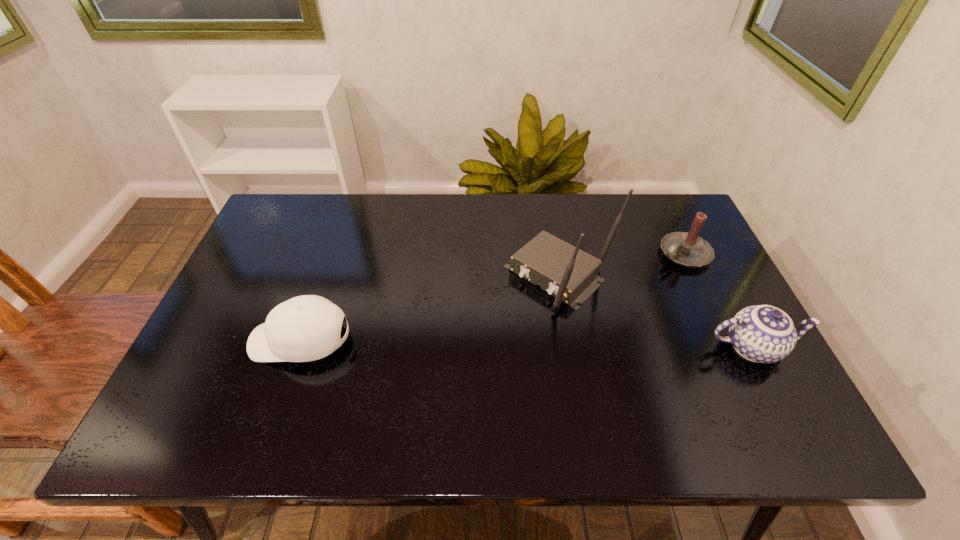
You are a GUI agent. You are given a task and a screenshot of the screen. Output one action in this format:
    pyautogui.click(x=<x>, y=<y>)
    Task: Click on the vacant space at the near right corner of the desktop
    This screenshot has height=540, width=960.
    Given the screenshot: What is the action you would take?
    pyautogui.click(x=709, y=385)

The height and width of the screenshot is (540, 960). What are the coordinates of `vacant space that is in between the candle and the router` in the screenshot? It's located at (621, 265).

Find the location of a particular element. The image size is (960, 540). vacant area that lies between the candle and the third object from right to left is located at coordinates (621, 265).

I want to click on empty space between the leftmost object and the candle, so click(492, 297).

Find the location of a particular element. Image resolution: width=960 pixels, height=540 pixels. free space between the chinaware and the leftmost object is located at coordinates coord(526,344).

Locate an element on the screen. The height and width of the screenshot is (540, 960). blank region between the chinaware and the candle is located at coordinates [718, 300].

Find the location of a particular element. This screenshot has width=960, height=540. blank region between the candle and the baseball cap is located at coordinates (492, 297).

Find the location of a particular element. free space between the router and the candle is located at coordinates (621, 265).

At what (x,y) coordinates should I click in order to perform the action: click on vacant area that lies between the third object from right to left and the leftmost object. Please return your answer as a coordinate pair (x, y). Image resolution: width=960 pixels, height=540 pixels. Looking at the image, I should click on (429, 309).

Where is `free space between the candle and the baseball cap`? Image resolution: width=960 pixels, height=540 pixels. free space between the candle and the baseball cap is located at coordinates (492, 297).